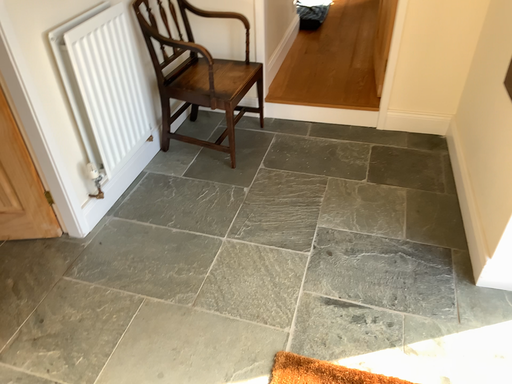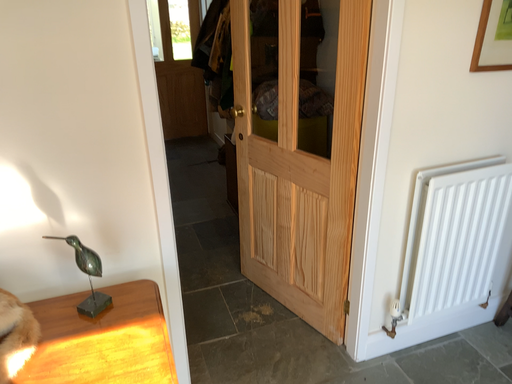
Question: Which way did the camera rotate in the video?

Choices:
 (A) rotated upward
 (B) rotated downward

Answer: (A)